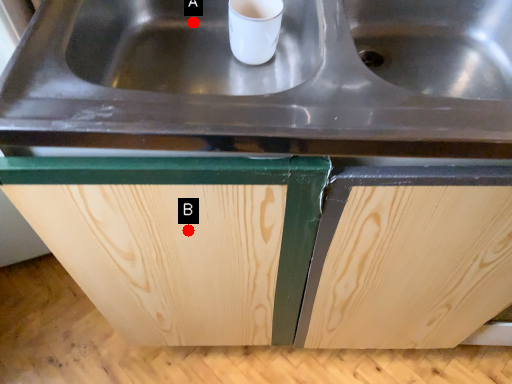
Question: Two points are circled on the image, labeled by A and B beside each circle. Which point is closer to the camera taking this photo?

Choices:
 (A) A is closer
 (B) B is closer

Answer: (B)